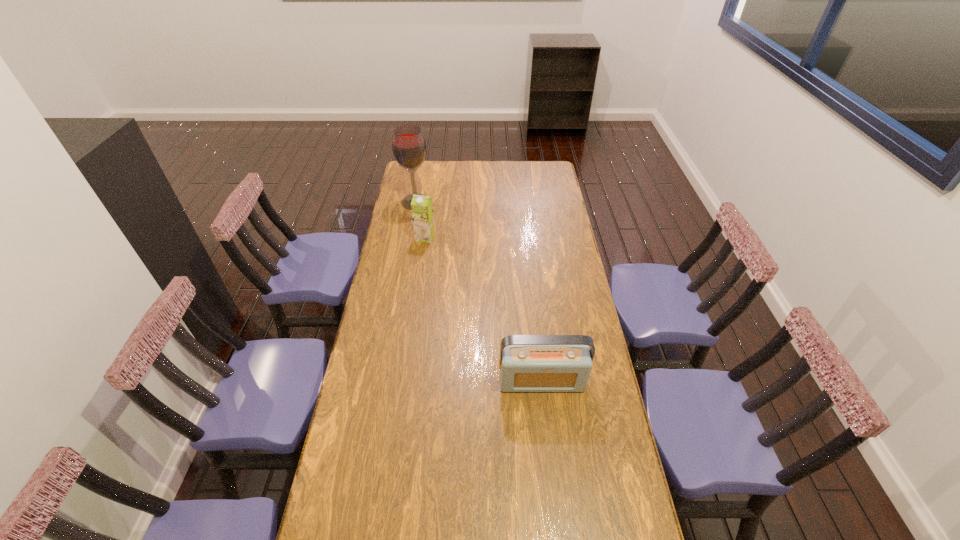
Find the location of a particular element. the tallest object is located at coordinates (408, 143).

Locate an element on the screen. This screenshot has width=960, height=540. alcohol is located at coordinates (408, 143).

The height and width of the screenshot is (540, 960). I want to click on the second nearest object, so click(x=421, y=206).

I want to click on the nearest object, so click(528, 363).

The image size is (960, 540). Identify the location of radio receiver. (528, 363).

This screenshot has width=960, height=540. I want to click on vacant space located on the front of the tallest object, so pyautogui.click(x=405, y=259).

Find the location of a particular element. The image size is (960, 540). vacant space located on the front of the soya milk is located at coordinates (420, 274).

The width and height of the screenshot is (960, 540). What are the coordinates of `free region located 0.100m on the front-facing side of the radio receiver` in the screenshot? It's located at (546, 420).

Where is `alcohol located at the left edge`? The width and height of the screenshot is (960, 540). alcohol located at the left edge is located at coordinates (408, 143).

I want to click on soya milk located in the left edge section of the desktop, so click(x=421, y=206).